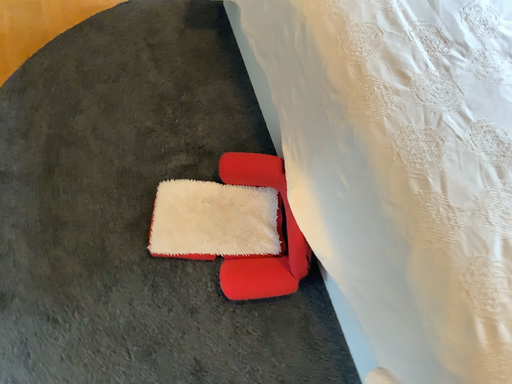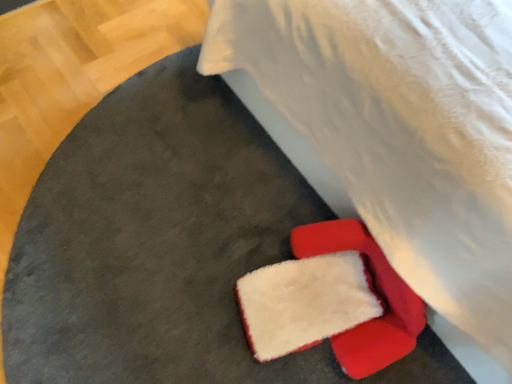
Question: Which way did the camera rotate in the video?

Choices:
 (A) rotated left
 (B) rotated right

Answer: (B)